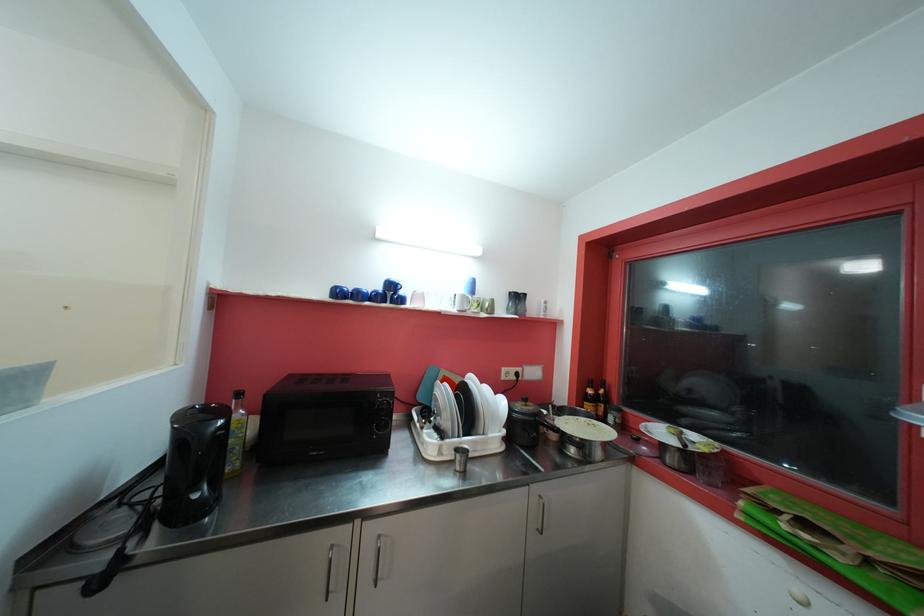
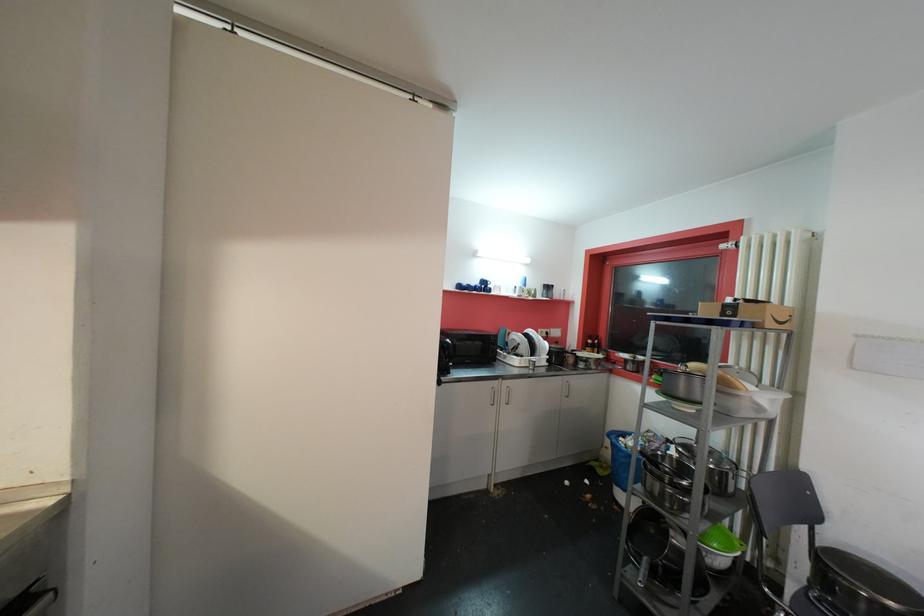
Where in the second image is the point corresponding to (x=396, y=288) from the first image?

(489, 285)